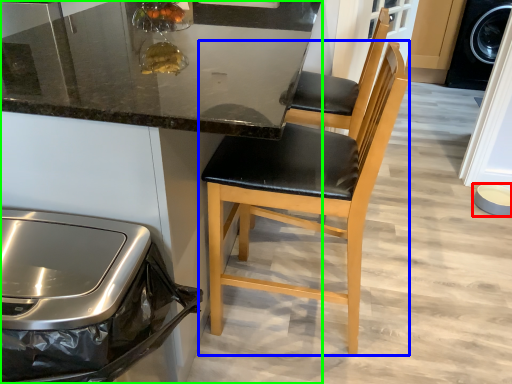
Question: Which is nearer to the bowl (highlighted by a red box)? chair (highlighted by a blue box) or cabinetry (highlighted by a green box).

Choices:
 (A) chair
 (B) cabinetry

Answer: (A)